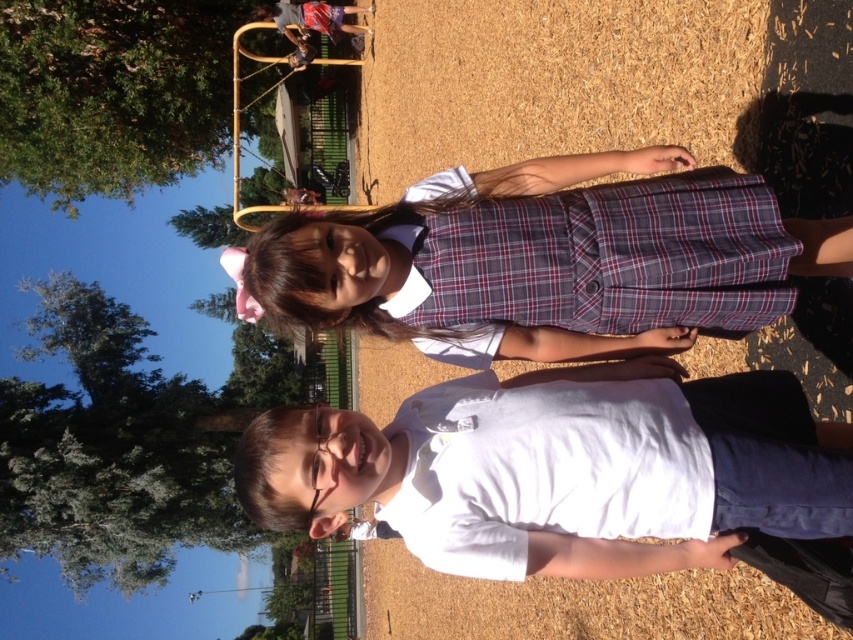
Question: Which point is closer to the camera?

Choices:
 (A) (749, 198)
 (B) (399, 486)

Answer: (B)

Question: Observing the image, what is the correct spatial positioning of white matte shirt at center in reference to plaid fabric dress at center?

Choices:
 (A) right
 (B) left

Answer: (A)

Question: Can you confirm if white matte shirt at center is smaller than plaid fabric dress at center?

Choices:
 (A) no
 (B) yes

Answer: (A)

Question: Which object appears farthest from the camera in this image?

Choices:
 (A) white matte shirt at center
 (B) plaid fabric dress at center

Answer: (B)

Question: Is white matte shirt at center positioned behind plaid fabric dress at center?

Choices:
 (A) yes
 (B) no

Answer: (B)